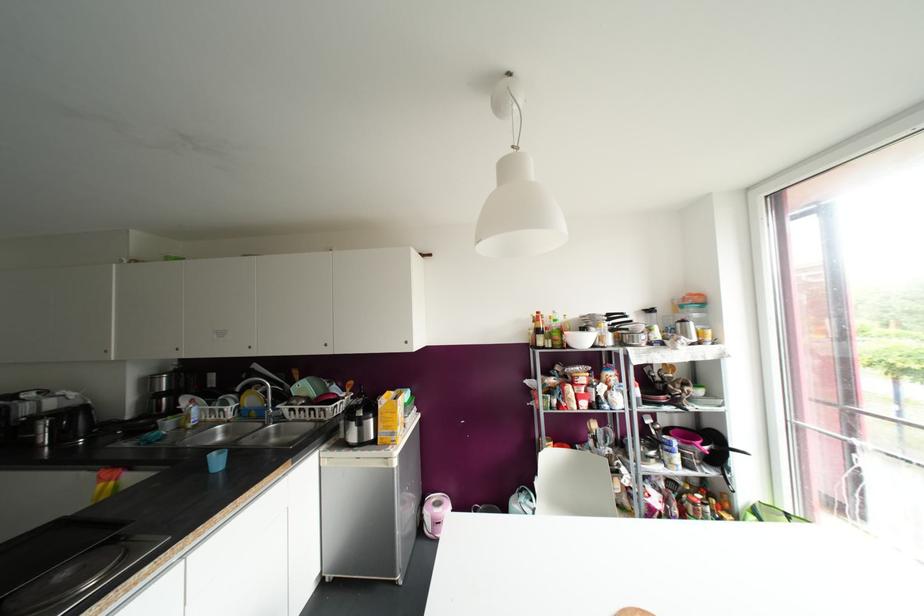
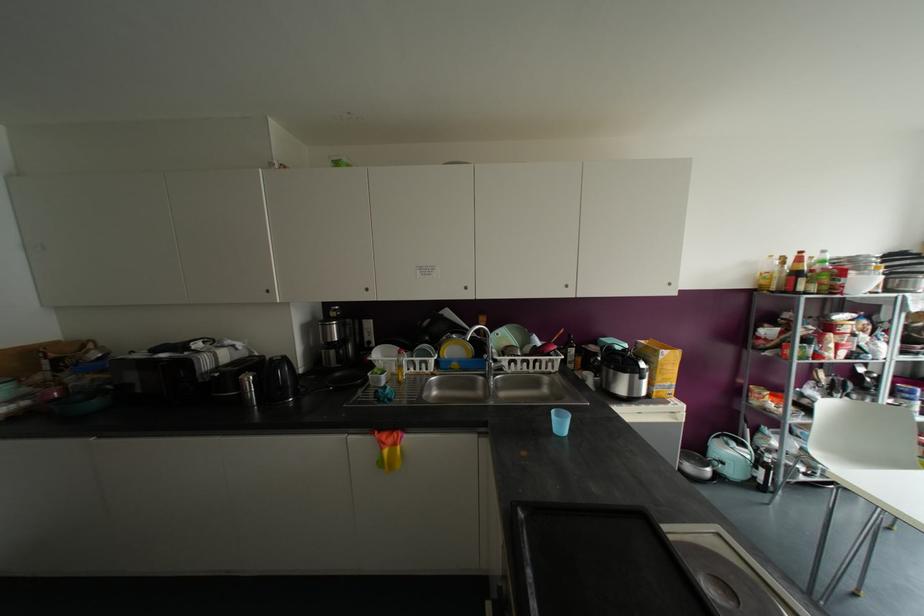
Question: Which direction would the cameraman need to move to produce the second image? Reply with the corresponding letter.

Choices:
 (A) Left
 (B) Right
 (C) Forward
 (D) Backward

Answer: (A)